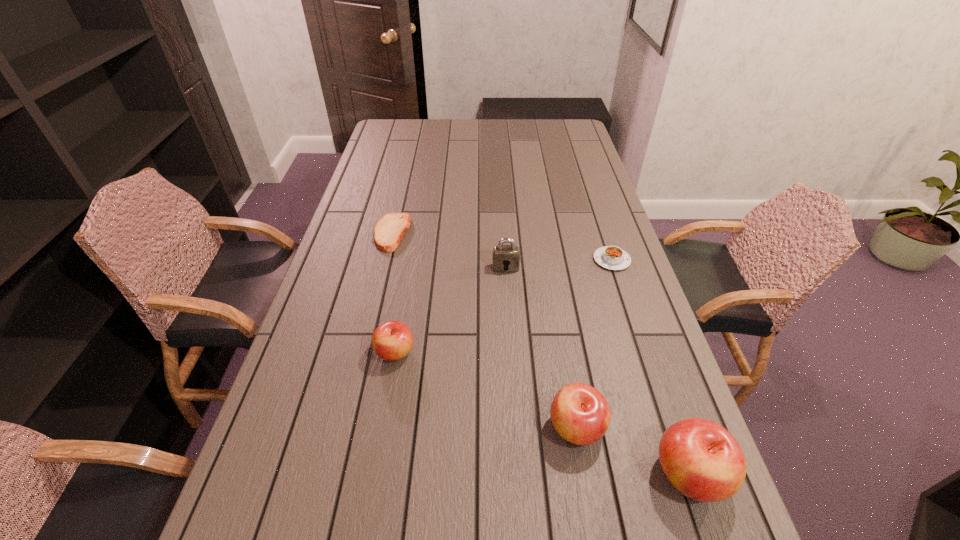
Identify the location of free spot located 0.180m on the back of the second apple from left to right. The image size is (960, 540). (562, 340).

Locate an element on the screen. Image resolution: width=960 pixels, height=540 pixels. blank area located 0.300m on the back of the tallest apple is located at coordinates (640, 331).

Locate an element on the screen. free spot located 0.310m at the front of the padlock near the keyhole is located at coordinates (512, 358).

Locate an element on the screen. Image resolution: width=960 pixels, height=540 pixels. vacant space located on the back of the fifth tallest object is located at coordinates [604, 237].

This screenshot has height=540, width=960. I want to click on vacant space located on the front of the pita bread, so click(385, 264).

The width and height of the screenshot is (960, 540). I want to click on object located at the near edge, so point(701,459).

Locate an element on the screen. Image resolution: width=960 pixels, height=540 pixels. object that is at the left edge is located at coordinates (390, 230).

Identify the location of apple present at the right edge. This screenshot has width=960, height=540. point(701,459).

You are a GUI agent. You are given a task and a screenshot of the screen. Output one action in this format:
    pyautogui.click(x=<x>, y=<y>)
    Task: Click on the pudding that is at the right edge
    
    Given the screenshot: What is the action you would take?
    pyautogui.click(x=611, y=257)

The width and height of the screenshot is (960, 540). In order to click on object that is at the near right corner in this screenshot , I will do `click(701, 459)`.